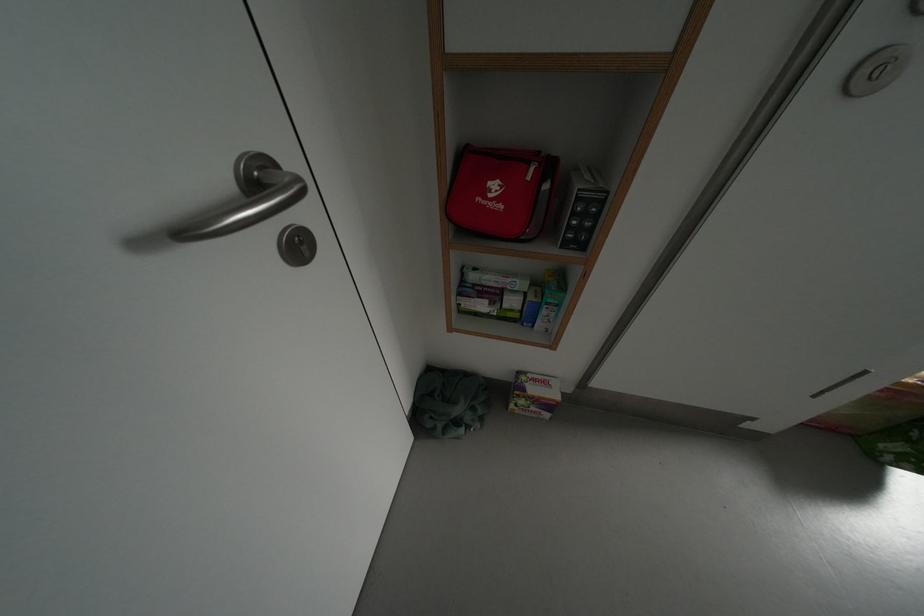
Where would you lift the black device box? Please return your answer as a coordinate pair (x, y).

(580, 209)